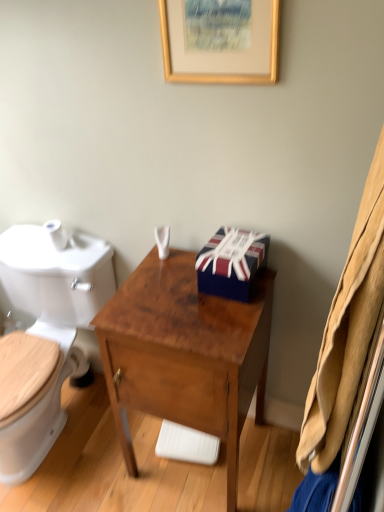
Image resolution: width=384 pixels, height=512 pixels. Identify the location of vacant space situated on the left part of white matte toilet paper at left. (38, 244).